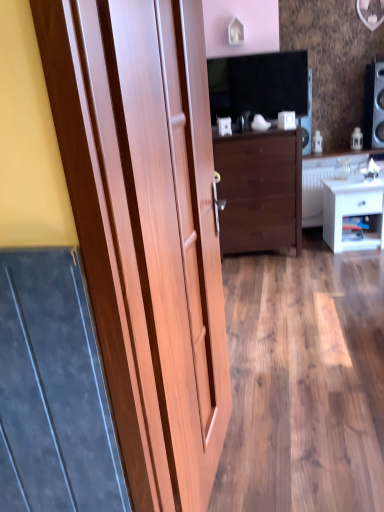
Question: Considering their positions, is white glossy counter top at center located in front of or behind wooden door at left?

Choices:
 (A) front
 (B) behind

Answer: (B)

Question: From the image's perspective, is white glossy counter top at center positioned above or below wooden door at left?

Choices:
 (A) above
 (B) below

Answer: (A)

Question: Which is farther from the white glossy counter top at center?

Choices:
 (A) dark wood chest of drawers at center
 (B) wooden door at left
 (C) white glossy nightstand at lower right
 (D) matte black tv at upper center
 (E) black glossy speaker at upper right

Answer: (B)

Question: Estimate the real-world distances between objects in this image. Which object is farther from the wooden door at left?

Choices:
 (A) white glossy nightstand at lower right
 (B) white glossy counter top at center
 (C) dark wood chest of drawers at center
 (D) black glossy speaker at upper right
 (E) matte black tv at upper center

Answer: (D)